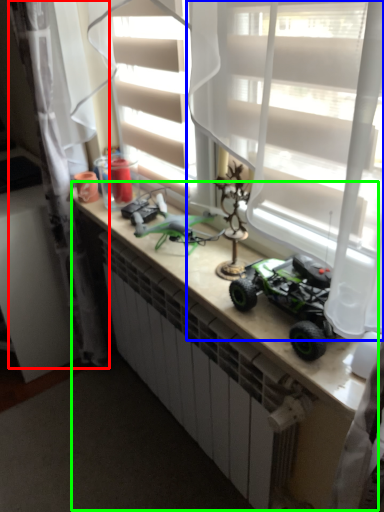
Question: Which object is positioned closest to curtain (highlighted by a red box)? Select from curtain (highlighted by a blue box) and counter (highlighted by a green box).

Choices:
 (A) curtain
 (B) counter

Answer: (B)